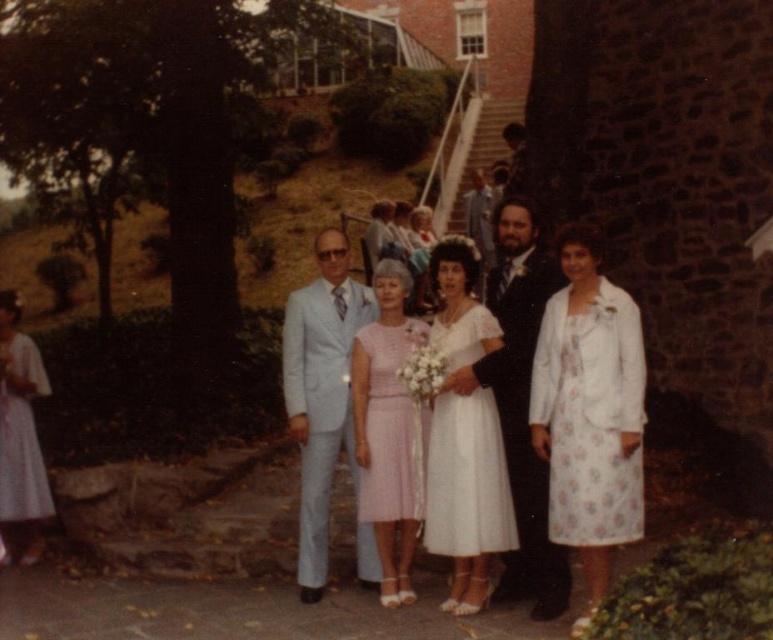
In the scene shown: You are a photographer setting up for a group photo at the described outdoor event. You need to ensure that the matte black suit at center and the pink textured dress at center are both visible in your shot. Based on their positions, which one should you focus on first to frame them properly?

The matte black suit at center is located below the pink textured dress at center, so you should focus on the pink textured dress at center first to ensure it is framed properly before adjusting for the lower positioned matte black suit at center.

You are a photographer adjusting your camera settings. You need to focus on the person wearing the matte black suit at center. Based on their position, which direction should you adjust the camera to ensure they are in the frame?

The matte black suit at center is located at point coordinates, so you should adjust the camera towards the center of the image to ensure they are in the frame.

You are a photographer setting up for a group photo. You have two main subjects in the frame, the light blue fabric suit at center and the white floral dress at left. Based on their positions and sizes, which subject should you focus on to ensure both are equally visible in the final image?

Since the light blue fabric suit at center occupies less space than the white floral dress at left, you should focus on the light blue fabric suit at center to balance their visibility in the photo.